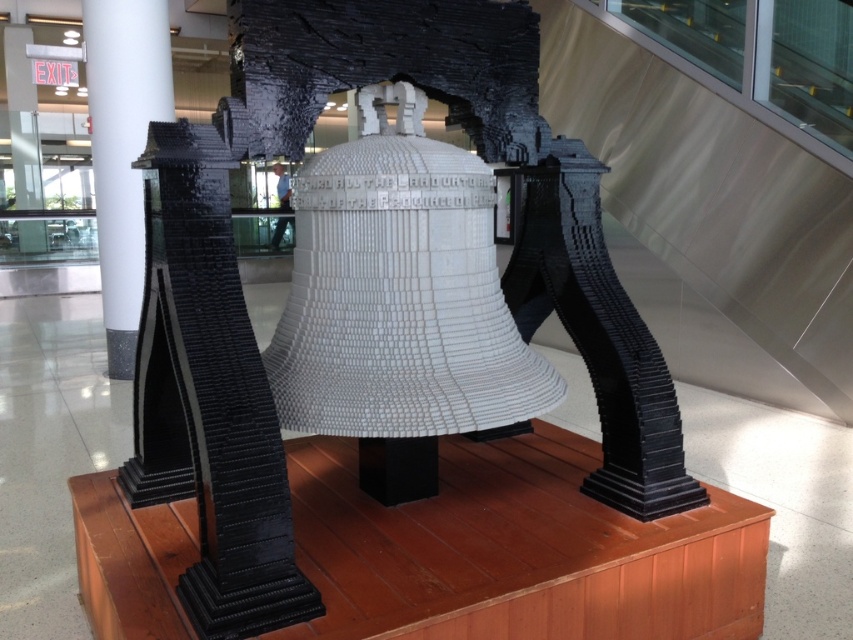
Which is more to the right, white lego bell at center or white glossy pillar at left?

white lego bell at center is more to the right.

Who is more forward, (234, 138) or (132, 17)?

Point (234, 138)

In order to click on white lego bell at center in this screenshot , I will do `click(244, 304)`.